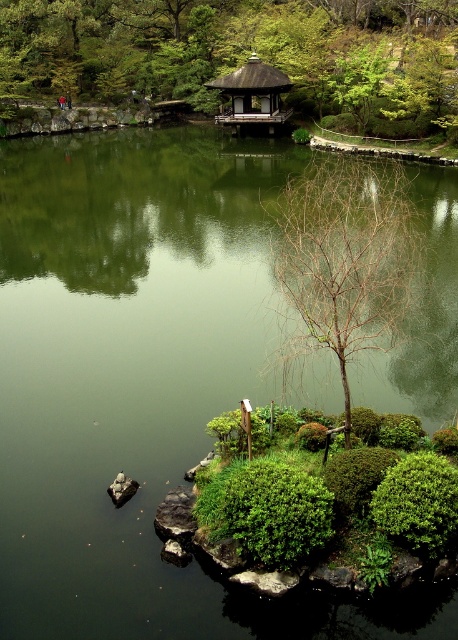
Question: Is the position of green leafy tree at upper center less distant than that of shiny dark brown gazebo at upper center?

Choices:
 (A) yes
 (B) no

Answer: (A)

Question: Based on their relative distances, which object is farther from the bare branches at center?

Choices:
 (A) shiny dark brown gazebo at upper center
 (B) smooth gray rock at lower left
 (C) green leafy tree at upper center

Answer: (C)

Question: Which object is positioned farthest from the smooth gray rock at lower left?

Choices:
 (A) shiny dark brown gazebo at upper center
 (B) bare branches at center
 (C) green leafy tree at upper center

Answer: (C)

Question: Is the position of bare branches at center less distant than that of shiny dark brown gazebo at upper center?

Choices:
 (A) yes
 (B) no

Answer: (A)

Question: Observing the image, what is the correct spatial positioning of green leafy tree at upper center in reference to bare branches at center?

Choices:
 (A) left
 (B) right

Answer: (A)

Question: Which object appears closest to the camera in this image?

Choices:
 (A) green leafy tree at upper center
 (B) shiny dark brown gazebo at upper center

Answer: (A)